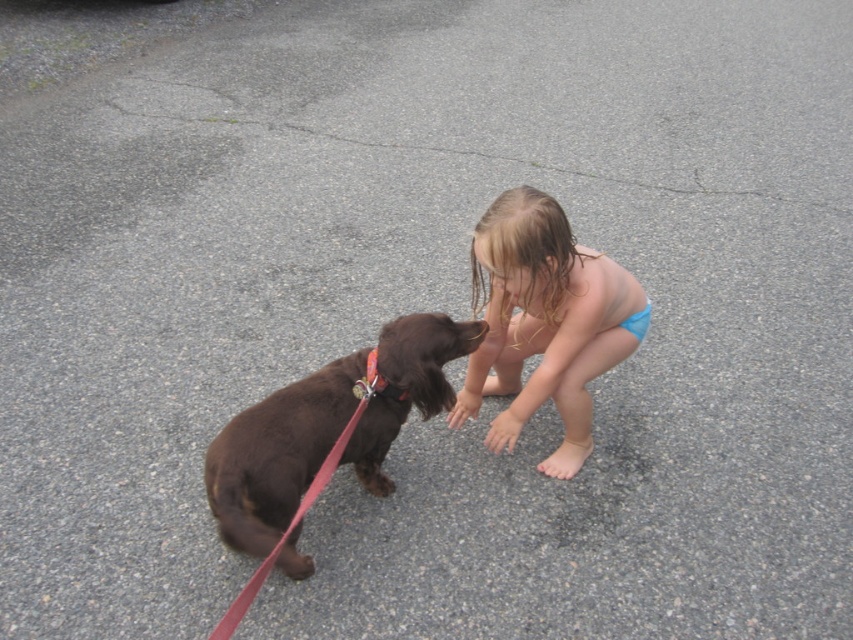
Question: Among these objects, which one is nearest to the camera?

Choices:
 (A) blue fabric bikini at center
 (B) shiny brown dog at center

Answer: (B)

Question: Is shiny brown dog at center wider than blue fabric bikini at center?

Choices:
 (A) no
 (B) yes

Answer: (B)

Question: Is shiny brown dog at center above blue fabric bikini at center?

Choices:
 (A) yes
 (B) no

Answer: (B)

Question: Does shiny brown dog at center appear on the left side of blue fabric bikini at center?

Choices:
 (A) yes
 (B) no

Answer: (A)

Question: Which of the following is the farthest from the observer?

Choices:
 (A) [x=569, y=332]
 (B) [x=213, y=464]

Answer: (A)